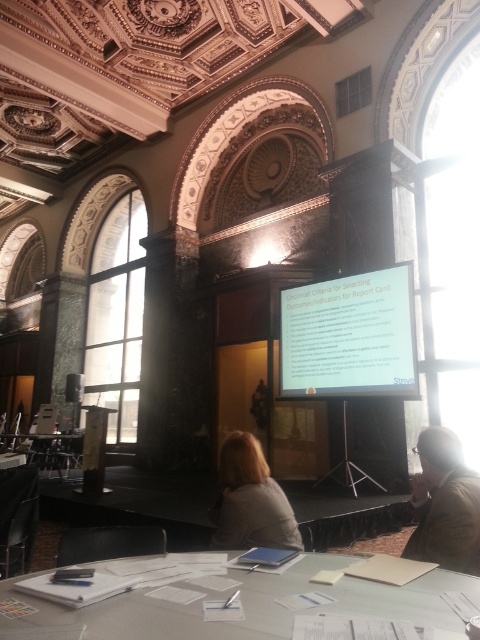
You are organizing a meeting in this conference room and need to place a 1.5 meter wide banner between the white glossy table at center and the gray fabric jacket at center. Is there enough space between them to fit the banner?

The white glossy table at center is positioned on the left side of gray fabric jacket at center, but the exact distance between them is not provided. Therefore, it is uncertain if the 1.5 meter wide banner can fit between them without further information.

You are organizing a small meeting in this conference room and need to place a 1.5 meter wide laptop stand on the table. Given the white glossy table at center and the gray fabric jacket at center, can the laptop stand fit on the table?

The white glossy table at center is wider than the gray fabric jacket at center. Since the table is wider, the 1.5 meter wide laptop stand can fit on the white glossy table at center provided the table is at least 1.5 meters wide.

You are organizing a presentation in the conference room and need to access your brown leather jacket at lower right. The white matte projector screen at center is blocking your path. Can you move the screen to retrieve your jacket?

The brown leather jacket at lower right is behind the white matte projector screen at center, so you can move the screen to access your jacket.